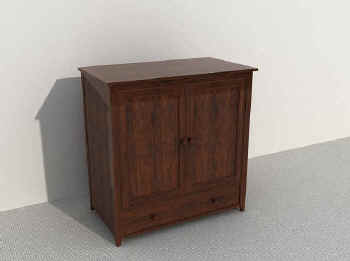
I want to click on space to the left of the cabinet, so click(57, 210).